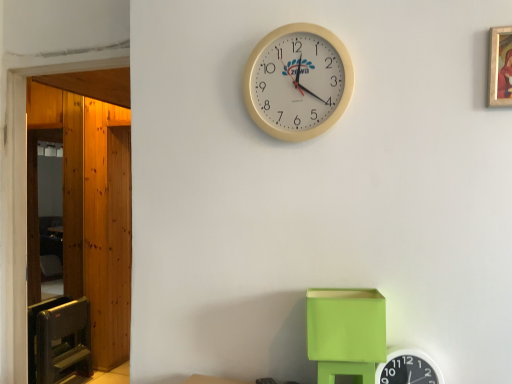
The width and height of the screenshot is (512, 384). What do you see at coordinates (298, 82) in the screenshot?
I see `beige plastic wall clock at upper center, which is the second wall clock in right-to-left order` at bounding box center [298, 82].

The image size is (512, 384). What do you see at coordinates (408, 368) in the screenshot?
I see `white plastic wall clock at upper center, acting as the second wall clock starting from the top` at bounding box center [408, 368].

You are a GUI agent. You are given a task and a screenshot of the screen. Output one action in this format:
    pyautogui.click(x=<x>, y=<y>)
    Task: Click on the wooden door at left
    This screenshot has width=512, height=384.
    Given the screenshot: What is the action you would take?
    pyautogui.click(x=89, y=198)

Can you confirm if beige plastic wall clock at upper center, marked as the 1th wall clock in a left-to-right arrangement, is smaller than lime green plastic cube at lower center?

Correct, beige plastic wall clock at upper center, marked as the 1th wall clock in a left-to-right arrangement, occupies less space than lime green plastic cube at lower center.

Is beige plastic wall clock at upper center, which is the second wall clock in right-to-left order, not close to lime green plastic cube at lower center?

No, beige plastic wall clock at upper center, which is the second wall clock in right-to-left order, is in close proximity to lime green plastic cube at lower center.

From a real-world perspective, between beige plastic wall clock at upper center, placed as the first wall clock when sorted from top to bottom, and lime green plastic cube at lower center, who is vertically higher?

beige plastic wall clock at upper center, placed as the first wall clock when sorted from top to bottom, is physically above.

How many degrees apart are the facing directions of beige plastic wall clock at upper center, which is the 2th wall clock in bottom-to-top order, and lime green plastic cube at lower center?

The angle between the facing direction of beige plastic wall clock at upper center, which is the 2th wall clock in bottom-to-top order, and the facing direction of lime green plastic cube at lower center is 0.523 degrees.

Considering the relative positions of gold-framed painting at upper right and lime green plastic cube at lower center in the image provided, is gold-framed painting at upper right to the left or to the right of lime green plastic cube at lower center?

From the image, it's evident that gold-framed painting at upper right is to the right of lime green plastic cube at lower center.

From a real-world perspective, is gold-framed painting at upper right above or below lime green plastic cube at lower center?

In terms of real-world spatial position, gold-framed painting at upper right is above lime green plastic cube at lower center.

From the image's perspective, does gold-framed painting at upper right appear higher than lime green plastic cube at lower center?

Correct, gold-framed painting at upper right appears higher than lime green plastic cube at lower center in the image.

Is gold-framed painting at upper right wider or thinner than lime green plastic cube at lower center?

gold-framed painting at upper right is thinner than lime green plastic cube at lower center.

Is point (395, 376) closer or farther from the camera than point (329, 298)?

Clearly, point (395, 376) is more distant from the camera than point (329, 298).

Which wall clock is the 1st one when counting from the back of the lime green plastic cube at lower center? Please provide its 2D coordinates.

[(408, 368)]

Is lime green plastic cube at lower center located within white plastic wall clock at upper center, which is the 2th wall clock in left-to-right order?

Definitely not — lime green plastic cube at lower center is not inside white plastic wall clock at upper center, which is the 2th wall clock in left-to-right order.

From a real-world perspective, is white plastic wall clock at upper center, the 1th wall clock when ordered from right to left, physically below lime green plastic cube at lower center?

Yes, from a real-world perspective, white plastic wall clock at upper center, the 1th wall clock when ordered from right to left, is beneath lime green plastic cube at lower center.

Does point (275, 90) come farther from viewer compared to point (96, 189)?

No.

Measure the distance from beige plastic wall clock at upper center, placed as the first wall clock when sorted from top to bottom, to wooden door at left.

They are 9.40 feet apart.

Starting from the wooden door at left, which wall clock is the 1st one to the right? Please provide its 2D coordinates.

[(298, 82)]

Considering the sizes of beige plastic wall clock at upper center, which is the 2th wall clock in bottom-to-top order, and wooden door at left in the image, is beige plastic wall clock at upper center, which is the 2th wall clock in bottom-to-top order, taller or shorter than wooden door at left?

Considering their sizes, beige plastic wall clock at upper center, which is the 2th wall clock in bottom-to-top order, has less height than wooden door at left.

From the image's perspective, is beige plastic wall clock at upper center, placed as the first wall clock when sorted from top to bottom, located above or below white plastic wall clock at upper center, the 1th wall clock when ordered from right to left?

From the image's perspective, beige plastic wall clock at upper center, placed as the first wall clock when sorted from top to bottom, appears above white plastic wall clock at upper center, the 1th wall clock when ordered from right to left.

Does beige plastic wall clock at upper center, placed as the first wall clock when sorted from top to bottom, have a greater width compared to white plastic wall clock at upper center, acting as the second wall clock starting from the top?

No, beige plastic wall clock at upper center, placed as the first wall clock when sorted from top to bottom, is not wider than white plastic wall clock at upper center, acting as the second wall clock starting from the top.

Could you measure the distance between beige plastic wall clock at upper center, which is the second wall clock in right-to-left order, and white plastic wall clock at upper center, the first wall clock ordered from the bottom?

beige plastic wall clock at upper center, which is the second wall clock in right-to-left order, and white plastic wall clock at upper center, the first wall clock ordered from the bottom, are 67.66 centimeters apart from each other.

Does point (277, 98) lie behind point (404, 352)?

Yes, point (277, 98) is farther from viewer.

Is the surface of lime green plastic cube at lower center in direct contact with gold-framed painting at upper right?

They are not placed beside each other.

Is lime green plastic cube at lower center behind gold-framed painting at upper right?

Yes, the depth of lime green plastic cube at lower center is greater than that of gold-framed painting at upper right.

In order to click on toy located behind the gold-framed painting at upper right in this screenshot , I will do (x=346, y=332).

Would you say lime green plastic cube at lower center is inside or outside gold-framed painting at upper right?

lime green plastic cube at lower center cannot be found inside gold-framed painting at upper right.

Considering the positions of objects white plastic wall clock at upper center, acting as the second wall clock starting from the top, and gold-framed painting at upper right in the image provided, who is in front, white plastic wall clock at upper center, acting as the second wall clock starting from the top, or gold-framed painting at upper right?

Positioned in front is gold-framed painting at upper right.

Does white plastic wall clock at upper center, the first wall clock ordered from the bottom, have a greater height compared to gold-framed painting at upper right?

Incorrect, the height of white plastic wall clock at upper center, the first wall clock ordered from the bottom, is not larger of that of gold-framed painting at upper right.

Are white plastic wall clock at upper center, the first wall clock ordered from the bottom, and gold-framed painting at upper right beside each other?

No, white plastic wall clock at upper center, the first wall clock ordered from the bottom, is not with gold-framed painting at upper right.

Is white plastic wall clock at upper center, acting as the second wall clock starting from the top, turned away from gold-framed painting at upper right?

No, white plastic wall clock at upper center, acting as the second wall clock starting from the top, is not facing the opposite direction of gold-framed painting at upper right.

Identify the location of toy that appears below the beige plastic wall clock at upper center, marked as the 1th wall clock in a left-to-right arrangement (from a real-world perspective). The height and width of the screenshot is (384, 512). (346, 332).

The width and height of the screenshot is (512, 384). What are the coordinates of `toy that is below the gold-framed painting at upper right (from the image's perspective)` in the screenshot? It's located at (346, 332).

Based on their spatial positions, is white plastic wall clock at upper center, acting as the second wall clock starting from the top, or lime green plastic cube at lower center closer to beige plastic wall clock at upper center, which is the 2th wall clock in bottom-to-top order?

Based on the image, lime green plastic cube at lower center appears to be nearer to beige plastic wall clock at upper center, which is the 2th wall clock in bottom-to-top order.

Based on their spatial positions, is white plastic wall clock at upper center, which is the 2th wall clock in left-to-right order, or gold-framed painting at upper right further from wooden door at left?

The object further to wooden door at left is gold-framed painting at upper right.

Based on their spatial positions, is beige plastic wall clock at upper center, placed as the first wall clock when sorted from top to bottom, or lime green plastic cube at lower center closer to wooden door at left?

Based on the image, beige plastic wall clock at upper center, placed as the first wall clock when sorted from top to bottom, appears to be nearer to wooden door at left.

Estimate the real-world distances between objects in this image. Which object is further from gold-framed painting at upper right, wooden door at left or beige plastic wall clock at upper center, which is the 2th wall clock in bottom-to-top order?

wooden door at left is positioned further to the anchor gold-framed painting at upper right.

When comparing their distances from beige plastic wall clock at upper center, marked as the 1th wall clock in a left-to-right arrangement, does wooden door at left or gold-framed painting at upper right seem further?

Among the two, wooden door at left is located further to beige plastic wall clock at upper center, marked as the 1th wall clock in a left-to-right arrangement.

From the picture: Based on their spatial positions, is gold-framed painting at upper right or beige plastic wall clock at upper center, which is the second wall clock in right-to-left order, closer to lime green plastic cube at lower center?

Among the two, beige plastic wall clock at upper center, which is the second wall clock in right-to-left order, is located nearer to lime green plastic cube at lower center.

From the image, which object appears to be nearer to beige plastic wall clock at upper center, placed as the first wall clock when sorted from top to bottom, gold-framed painting at upper right or wooden door at left?

gold-framed painting at upper right lies closer to beige plastic wall clock at upper center, placed as the first wall clock when sorted from top to bottom, than the other object.

Which object lies further to the anchor point white plastic wall clock at upper center, the first wall clock ordered from the bottom, beige plastic wall clock at upper center, which is the 2th wall clock in bottom-to-top order, or gold-framed painting at upper right?

beige plastic wall clock at upper center, which is the 2th wall clock in bottom-to-top order, is further to white plastic wall clock at upper center, the first wall clock ordered from the bottom.

You are a GUI agent. You are given a task and a screenshot of the screen. Output one action in this format:
    pyautogui.click(x=<x>, y=<y>)
    Task: Click on the wall clock between gold-framed painting at upper right and lime green plastic cube at lower center in the vertical direction
    
    Given the screenshot: What is the action you would take?
    pyautogui.click(x=298, y=82)

Locate an element on the screen. This screenshot has height=384, width=512. wall clock between wooden door at left and white plastic wall clock at upper center, the first wall clock ordered from the bottom, in the horizontal direction is located at coordinates click(x=298, y=82).

This screenshot has width=512, height=384. What are the coordinates of `wall clock between wooden door at left and lime green plastic cube at lower center` in the screenshot? It's located at (298, 82).

Locate an element on the screen. The width and height of the screenshot is (512, 384). wall clock between gold-framed painting at upper right and white plastic wall clock at upper center, the first wall clock ordered from the bottom, in the up-down direction is located at coordinates (298, 82).